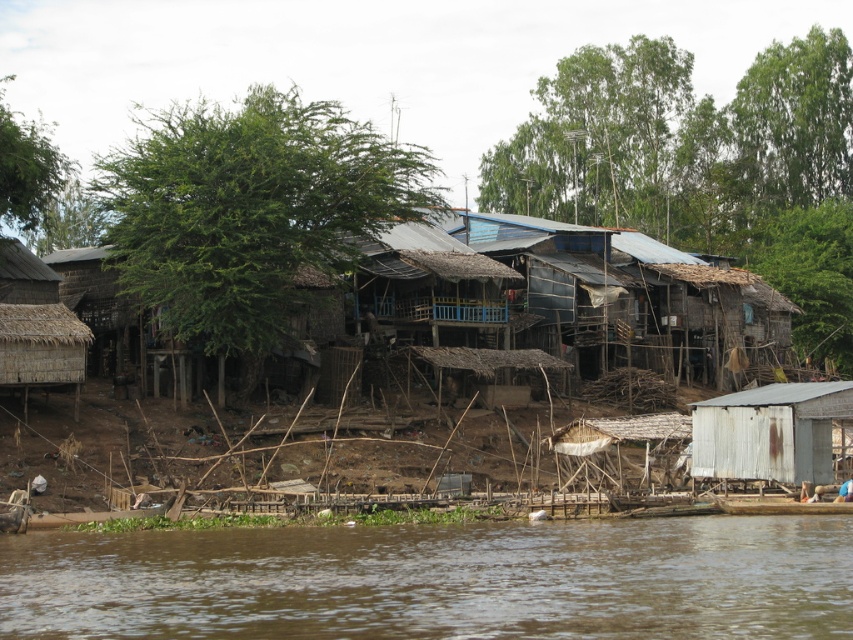
Question: Which point appears farthest from the camera in this image?

Choices:
 (A) (741, 396)
 (B) (566, 611)

Answer: (A)

Question: Can you confirm if brown muddy water at lower center is smaller than white weathered shack at lower right?

Choices:
 (A) yes
 (B) no

Answer: (B)

Question: Is brown muddy water at lower center above white weathered shack at lower right?

Choices:
 (A) yes
 (B) no

Answer: (B)

Question: Can you confirm if brown muddy water at lower center is positioned to the left of white weathered shack at lower right?

Choices:
 (A) no
 (B) yes

Answer: (B)

Question: Among these objects, which one is nearest to the camera?

Choices:
 (A) white weathered shack at lower right
 (B) brown muddy water at lower center

Answer: (B)